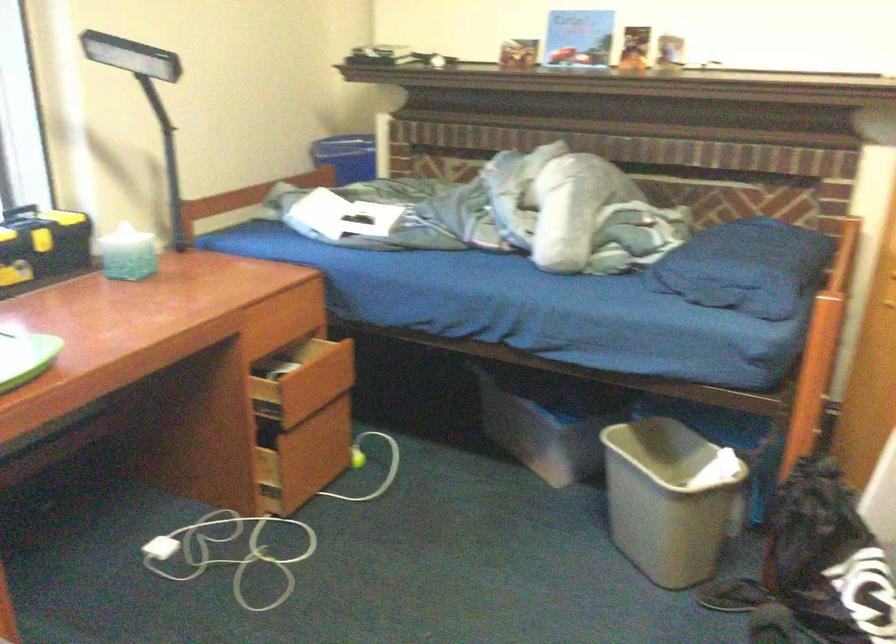
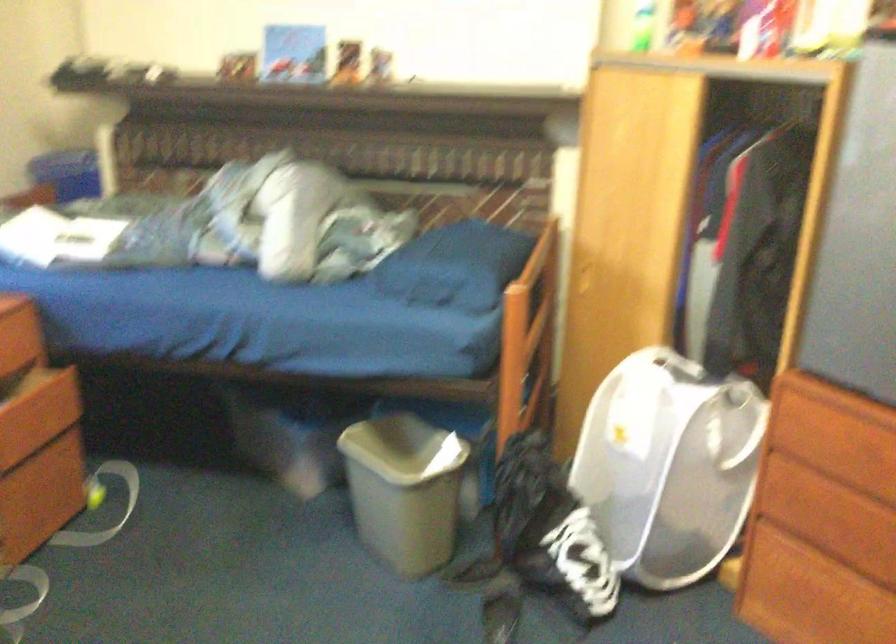
What movement of the cameraman would produce the second image?

The movement direction of the cameraman is right, backward.